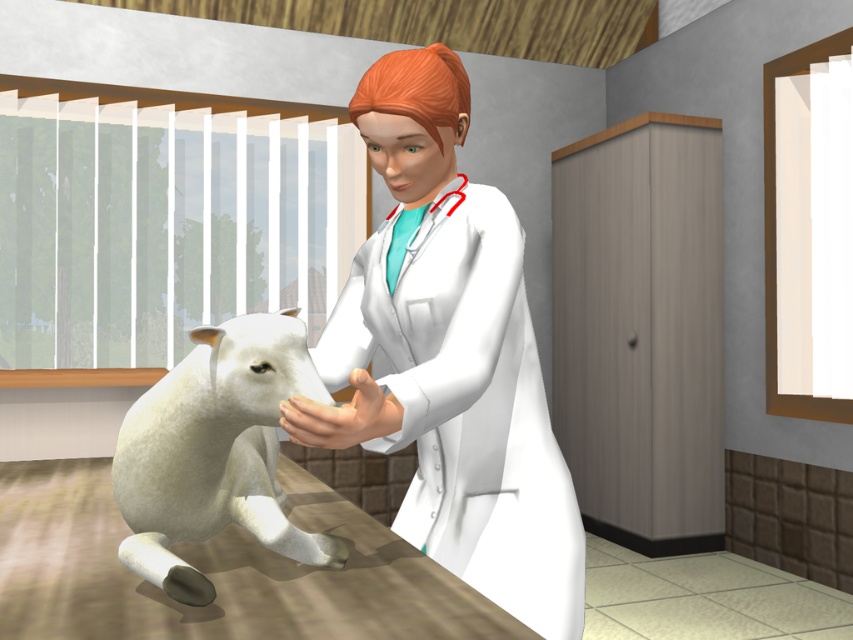
Does point (526, 435) lie behind point (173, 420)?

That is True.

Can you confirm if white matte coat at center is positioned below white woolen lamb at center?

No, white matte coat at center is not below white woolen lamb at center.

Locate an element on the screen. white matte coat at center is located at coordinates (450, 356).